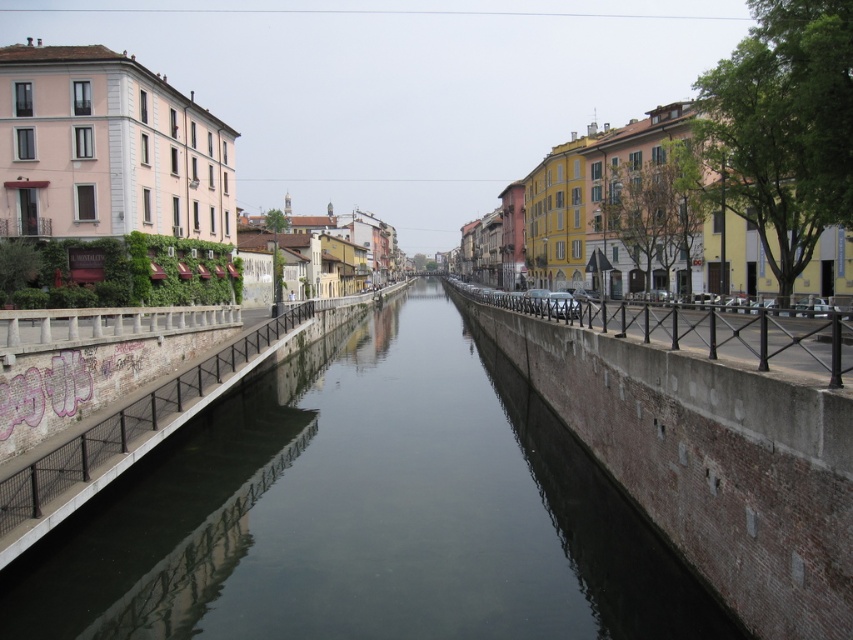
You are a tourist standing on the sidewalk next to the smooth concrete canal at center and the black metal railing at center. Which object is closer to the left side of the canal?

The smooth concrete canal at center is to the left of the black metal railing at center, so the smooth concrete canal at center is closer to the left side of the canal.

You are a delivery person trying to cross the canal in the image. You see the smooth concrete canal at center and the concrete bridge at center. Which one should you use to safely cross the canal?

You should use the concrete bridge at center to safely cross the canal because it is a structure designed for crossing, while the smooth concrete canal at center is the waterway itself and not passable on foot.

You are standing on the sidewalk next to the smooth concrete canal at center. You want to toss a small pebble into the canal. Considering the distance, can you estimate how far you need to throw it to reach the water?

The smooth concrete canal at center is 38.06 feet away from you, so you would need to throw the pebble approximately 38.06 feet to reach it.